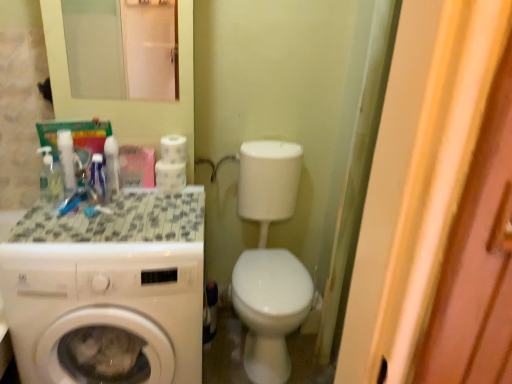
The image size is (512, 384). What are the coordinates of `vacant space situated above tile mosaic countertop at left (from a real-world perspective)` in the screenshot? It's located at (88, 212).